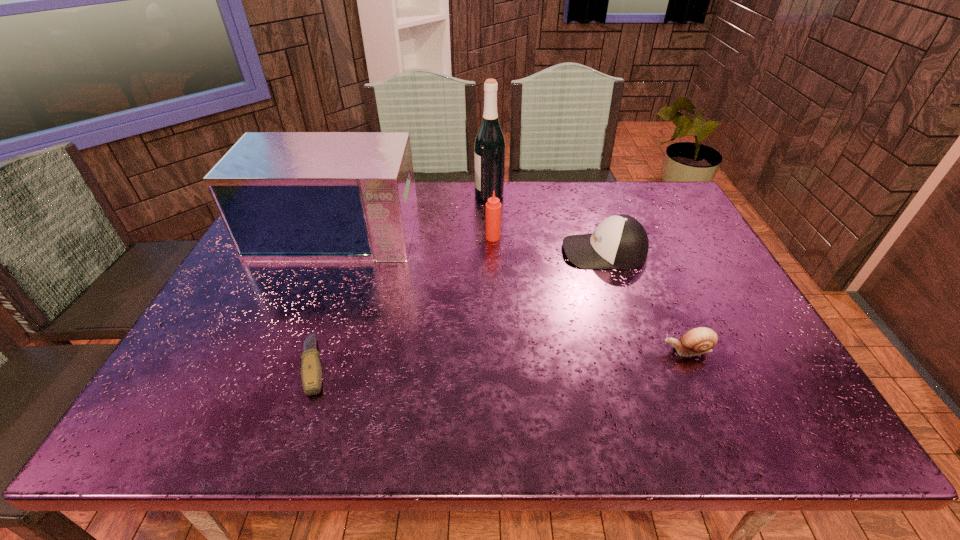
The image size is (960, 540). I want to click on free point between the fourth tallest object and the tallest object, so click(546, 224).

The image size is (960, 540). What are the coordinates of `free spot between the escargot and the pocketknife` in the screenshot? It's located at click(x=501, y=357).

The height and width of the screenshot is (540, 960). In order to click on free space between the third shortest object and the fifth shortest object in this screenshot , I will do `click(471, 239)`.

This screenshot has height=540, width=960. In order to click on free space between the Tabasco sauce and the pocketknife in this screenshot , I will do `click(404, 301)`.

Find the location of a particular element. This screenshot has height=540, width=960. free space between the shortest object and the third tallest object is located at coordinates (404, 301).

You are a GUI agent. You are given a task and a screenshot of the screen. Output one action in this format:
    pyautogui.click(x=<x>, y=<y>)
    Task: Click on the free space between the third tallest object and the escargot
    
    Given the screenshot: What is the action you would take?
    pyautogui.click(x=589, y=294)

Where is `free spot between the third shortest object and the pocketknife`? This screenshot has width=960, height=540. free spot between the third shortest object and the pocketknife is located at coordinates (460, 308).

Find the location of a particular element. free point between the escargot and the Tabasco sauce is located at coordinates (589, 294).

Point out which object is positioned as the nearest to the fifth shortest object. Please provide its 2D coordinates. Your answer should be formatted as a tuple, i.e. [(x, y)], where the tuple contains the x and y coordinates of a point satisfying the conditions above.

[(489, 148)]

Locate an element on the screen. Image resolution: width=960 pixels, height=540 pixels. the third closest object to the microwave oven is located at coordinates (311, 372).